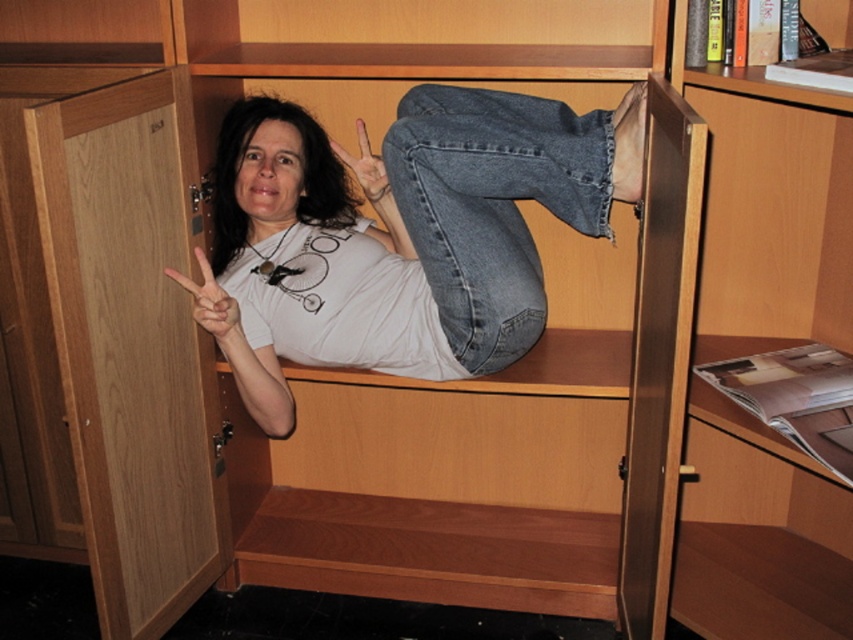
What are the coordinates of `denim at center` in the screenshot? It's located at (492, 205).

Which is in front, point (386, 164) or point (201, 289)?

Point (386, 164)

I want to click on denim at center, so click(492, 205).

You are a GUI agent. You are given a task and a screenshot of the screen. Output one action in this format:
    pyautogui.click(x=<x>, y=<y>)
    Task: Click on the denim at center
    The width and height of the screenshot is (853, 640).
    Given the screenshot: What is the action you would take?
    (x=492, y=205)

Can you confirm if white matte t-shirt at center is thinner than white matte hand at center?

No.

Based on the photo, which is more to the right, white matte t-shirt at center or white matte hand at center?

white matte t-shirt at center

Measure the distance between point (260, 189) and camera.

Point (260, 189) and camera are 1.81 meters apart.

This screenshot has width=853, height=640. Find the location of `white matte t-shirt at center`. white matte t-shirt at center is located at coordinates (405, 234).

Where is `white matte t-shirt at center`? The image size is (853, 640). white matte t-shirt at center is located at coordinates (405, 234).

Can you confirm if white matte t-shirt at center is positioned above denim at center?

Yes, white matte t-shirt at center is above denim at center.

Does point (544, 307) come farther from viewer compared to point (474, 352)?

No, it is in front of (474, 352).

I want to click on white matte t-shirt at center, so click(405, 234).